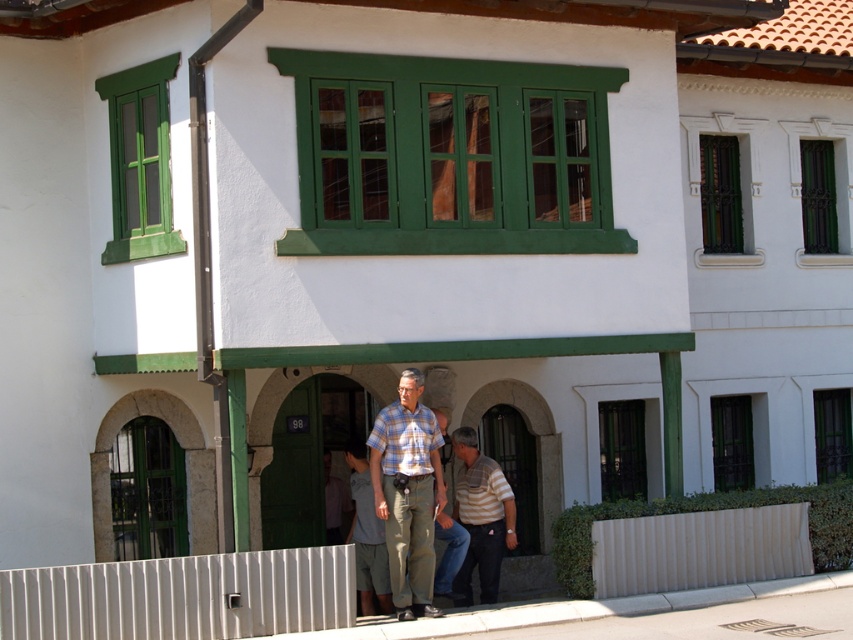
Question: Which object is the farthest from the striped cotton shirt at center?

Choices:
 (A) green metal/glass at center right
 (B) plaid cotton shirt at center

Answer: (A)

Question: Is striped cotton shirt at center to the right of green metal/glass window at upper center from the viewer's perspective?

Choices:
 (A) no
 (B) yes

Answer: (A)

Question: Is striped cotton shirt at center smaller than green metal/glass window at upper center?

Choices:
 (A) no
 (B) yes

Answer: (A)

Question: Estimate the real-world distances between objects in this image. Which object is farther from the light brown leather shirt at center?

Choices:
 (A) striped cotton shirt at center
 (B) light blue striped shirt at center
 (C) green metal/glass window at upper center

Answer: (C)

Question: Which object is closer to the camera taking this photo?

Choices:
 (A) plaid shirt at center
 (B) plaid cotton shirt at center
 (C) light brown leather shirt at center
 (D) green metal/glass at center right

Answer: (B)

Question: Can you confirm if green metal/glass window at upper center is positioned above light brown leather shirt at center?

Choices:
 (A) yes
 (B) no

Answer: (A)